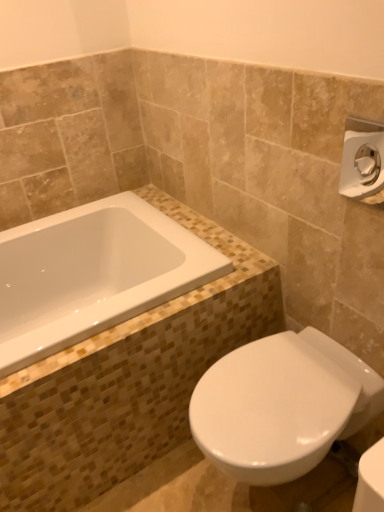
Question: In the image, is satin nickel towel bar at upper right on the left side or the right side of white glossy bathtub at upper left?

Choices:
 (A) left
 (B) right

Answer: (B)

Question: Which is correct: satin nickel towel bar at upper right is inside white glossy bathtub at upper left, or outside of it?

Choices:
 (A) inside
 (B) outside

Answer: (B)

Question: Which is nearer to the white glossy bathtub at upper left?

Choices:
 (A) satin nickel towel bar at upper right
 (B) white glossy toilet at lower right

Answer: (B)

Question: Which object is the farthest from the white glossy bathtub at upper left?

Choices:
 (A) satin nickel towel bar at upper right
 (B) white glossy toilet at lower right

Answer: (A)